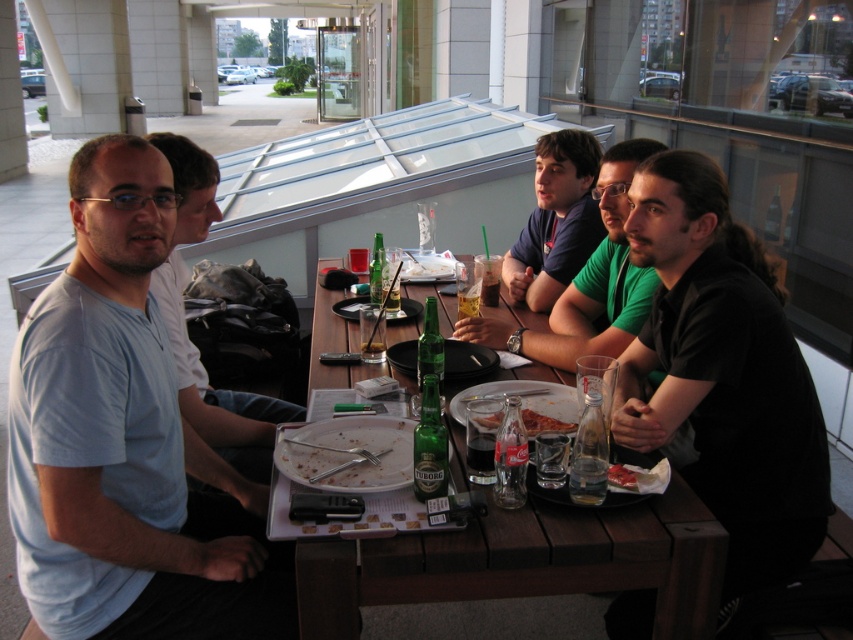
Question: Which point is closer to the camera?

Choices:
 (A) crumbly pizza at center
 (B) clear glass water at table center
 (C) black matte shirt at right
 (D) light blue t-shirt at left

Answer: (B)

Question: In this image, where is light blue cotton shirt at left located relative to red tomato slice at center?

Choices:
 (A) above
 (B) below

Answer: (A)

Question: Is light blue cotton shirt at left wider than crumbly pizza at center?

Choices:
 (A) no
 (B) yes

Answer: (B)

Question: Does wooden table at center appear on the left side of clear plastic bottle at table center?

Choices:
 (A) yes
 (B) no

Answer: (A)

Question: Considering the real-world distances, which object is farthest from the black matte shirt at right?

Choices:
 (A) clear plastic bottle at table center
 (B) light blue cotton shirt at left

Answer: (B)

Question: Which object appears farthest from the camera in this image?

Choices:
 (A) light blue t-shirt at left
 (B) green matte shirt at center
 (C) clear glass water at table center

Answer: (B)